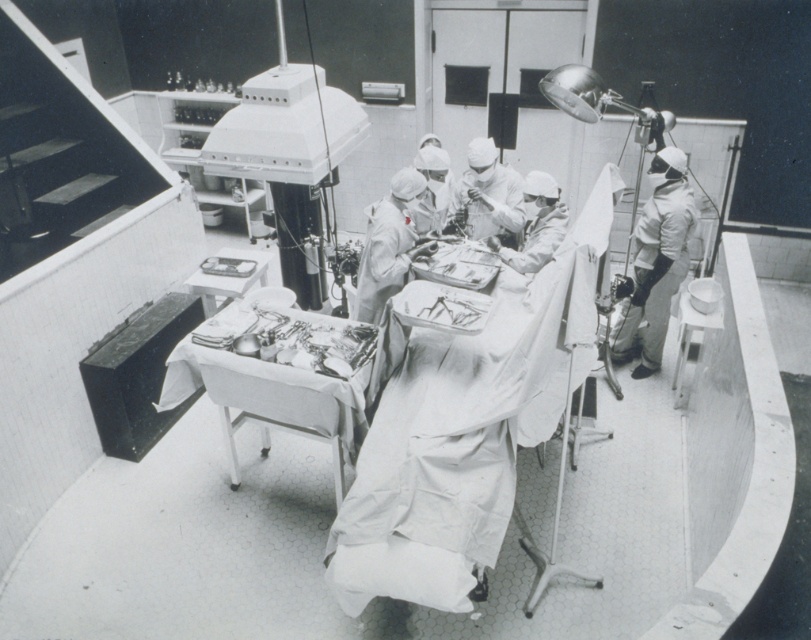
Question: Does metallic silver tray at center have a larger size compared to white matte uniform at right?

Choices:
 (A) no
 (B) yes

Answer: (B)

Question: Is metallic silver tray at center wider than white matte uniform at right?

Choices:
 (A) yes
 (B) no

Answer: (A)

Question: Which of the following is the closest to the observer?

Choices:
 (A) metallic silver tray at center
 (B) white matte uniform at right

Answer: (A)

Question: Can you confirm if metallic silver tray at center is positioned to the right of white matte uniform at right?

Choices:
 (A) yes
 (B) no

Answer: (B)